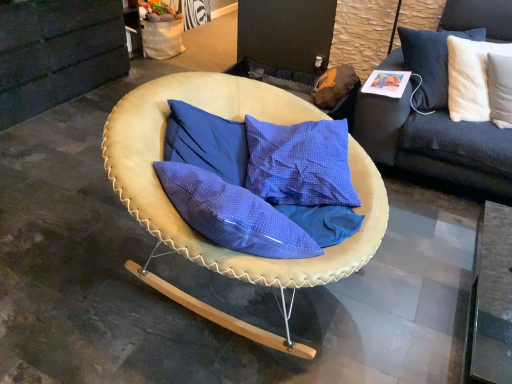
Question: In terms of height, does dark gray fabric couch at upper right look taller or shorter compared to white soft cushion at upper right?

Choices:
 (A) tall
 (B) short

Answer: (A)

Question: Is dark gray fabric couch at upper right wider or thinner than white soft cushion at upper right?

Choices:
 (A) wide
 (B) thin

Answer: (A)

Question: Based on their relative distances, which object is farther from the white soft cushion at upper right?

Choices:
 (A) leather-like beige chair at center
 (B) dark gray fabric couch at upper right

Answer: (A)

Question: Which of these objects is positioned farthest from the dark gray fabric couch at upper right?

Choices:
 (A) white soft cushion at upper right
 (B) leather-like beige chair at center

Answer: (B)